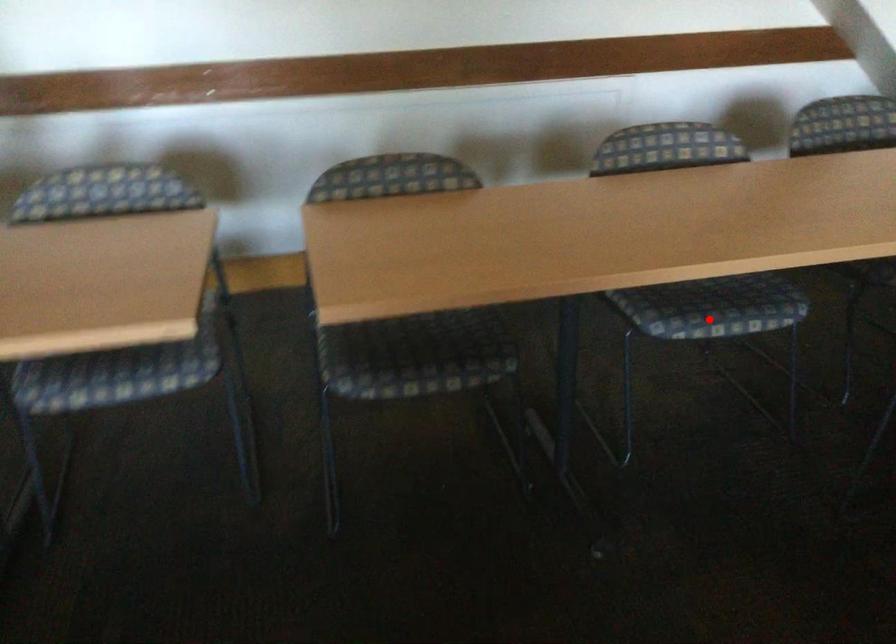
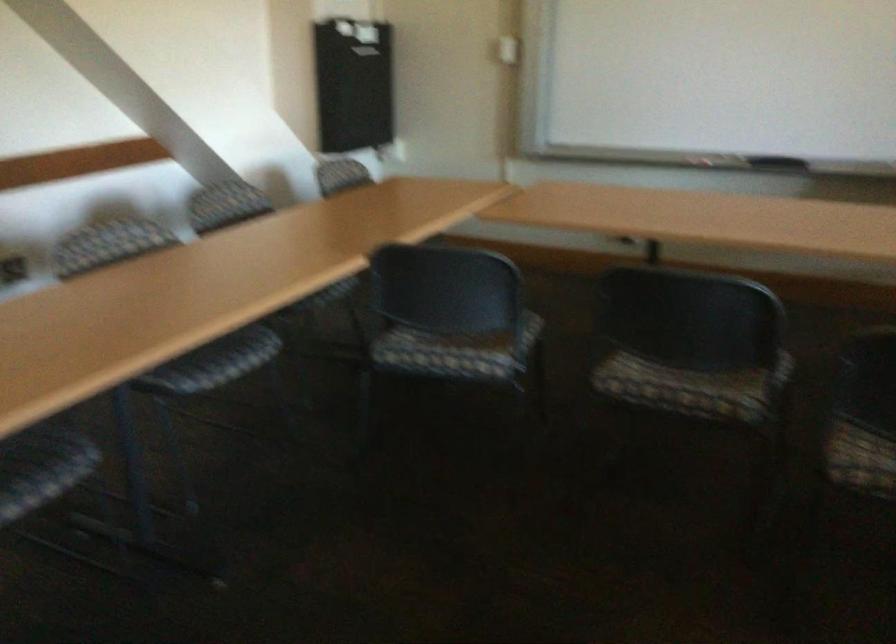
In the second image, find the point that corresponds to the highlighted location in the first image.

(219, 366)